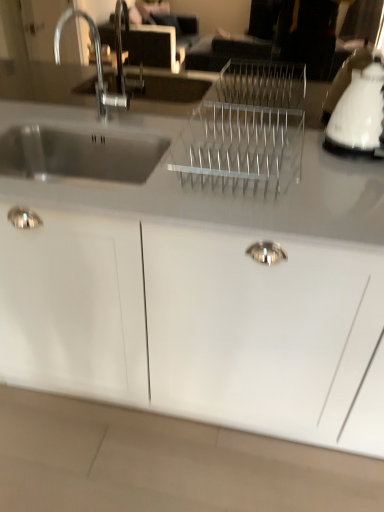
Identify the location of vacant area that is in front of white glossy kettle at upper right. (354, 180).